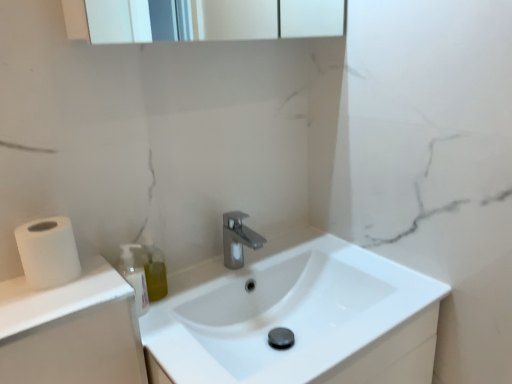
Describe the element at coordinates (296, 319) in the screenshot. I see `white glossy sink at center` at that location.

Where is `translucent plastic soap dispenser at left`? The width and height of the screenshot is (512, 384). translucent plastic soap dispenser at left is located at coordinates (134, 276).

Describe the element at coordinates (134, 276) in the screenshot. I see `translucent plastic soap dispenser at left` at that location.

Locate an element on the screen. The width and height of the screenshot is (512, 384). white matte toilet paper at left is located at coordinates (48, 252).

In the scene shown: Is translucent plastic soap dispenser at left further to the viewer compared to white glossy sink at center?

Yes, translucent plastic soap dispenser at left is further from the camera.

This screenshot has width=512, height=384. I want to click on sink located on the right of translucent plastic soap dispenser at left, so click(x=296, y=319).

Is translucent plastic soap dispenser at left aimed at white glossy sink at center?

No, translucent plastic soap dispenser at left is not facing towards white glossy sink at center.

Is translucent plastic soap dispenser at left at the back of satin nickel faucet at center?

satin nickel faucet at center is not turned away from translucent plastic soap dispenser at left.

Is satin nickel faucet at center to the right of translucent plastic soap dispenser at left from the viewer's perspective?

Correct, you'll find satin nickel faucet at center to the right of translucent plastic soap dispenser at left.

Which object is further away from the camera taking this photo, satin nickel faucet at center or translucent plastic soap dispenser at left?

satin nickel faucet at center is more distant.

Is white glossy sink at center positioned far away from satin nickel faucet at center?

white glossy sink at center is near satin nickel faucet at center, not far away.

Looking at this image, which of these two, white glossy sink at center or satin nickel faucet at center, is wider?

white glossy sink at center.

Is white glossy sink at center bigger than satin nickel faucet at center?

Yes, white glossy sink at center is bigger than satin nickel faucet at center.

Is point (395, 381) positioned after point (255, 233)?

No, (395, 381) is closer to viewer.

In the image, is translucent plastic soap dispenser at left on the left side or the right side of satin nickel faucet at center?

translucent plastic soap dispenser at left is to the left of satin nickel faucet at center.

Is the position of translucent plastic soap dispenser at left less distant than that of satin nickel faucet at center?

That is True.

Do you think translucent plastic soap dispenser at left is within satin nickel faucet at center, or outside of it?

translucent plastic soap dispenser at left lies outside satin nickel faucet at center.

Is translucent plastic soap dispenser at left far from satin nickel faucet at center?

No, translucent plastic soap dispenser at left is in close proximity to satin nickel faucet at center.

Considering the relative sizes of satin nickel faucet at center and white glossy sink at center in the image provided, is satin nickel faucet at center shorter than white glossy sink at center?

Correct, satin nickel faucet at center is not as tall as white glossy sink at center.

Does satin nickel faucet at center come behind white glossy sink at center?

Yes, it is behind white glossy sink at center.

Which is correct: satin nickel faucet at center is inside white glossy sink at center, or outside of it?

satin nickel faucet at center exists outside the volume of white glossy sink at center.

Would you consider satin nickel faucet at center to be distant from white glossy sink at center?

No, satin nickel faucet at center is in close proximity to white glossy sink at center.

Between point (34, 287) and point (139, 295), which one is positioned behind?

The point (139, 295) is behind.

Is white matte toilet paper at left facing away from translucent plastic soap dispenser at left?

No, translucent plastic soap dispenser at left is not at the back of white matte toilet paper at left.

Between white matte toilet paper at left and translucent plastic soap dispenser at left, which one has smaller size?

With smaller size is translucent plastic soap dispenser at left.

Does white matte toilet paper at left have a greater height compared to translucent plastic soap dispenser at left?

No, white matte toilet paper at left is not taller than translucent plastic soap dispenser at left.

Can you confirm if white glossy sink at center is taller than translucent plastic soap dispenser at left?

Correct, white glossy sink at center is much taller as translucent plastic soap dispenser at left.

Would you consider white glossy sink at center to be distant from translucent plastic soap dispenser at left?

No.

Based on the photo, how different are the orientations of white glossy sink at center and translucent plastic soap dispenser at left in degrees?

The angle between the facing direction of white glossy sink at center and the facing direction of translucent plastic soap dispenser at left is 0.902 degrees.

From a real-world perspective, between white glossy sink at center and translucent plastic soap dispenser at left, who is vertically lower?

white glossy sink at center is physically lower.

At what (x,y) coordinates should I click in order to perform the action: click on bottle that appears on the left of white glossy sink at center. Please return your answer as a coordinate pair (x, y). Looking at the image, I should click on (134, 276).

Locate an element on the screen. Image resolution: width=512 pixels, height=384 pixels. tap that is above the translucent plastic soap dispenser at left (from the image's perspective) is located at coordinates (238, 239).

Looking at the image, which one is located further to white glossy sink at center, white matte toilet paper at left or satin nickel faucet at center?

The object further to white glossy sink at center is white matte toilet paper at left.

When comparing their distances from satin nickel faucet at center, does translucent plastic soap dispenser at left or white glossy sink at center seem further?

Among the two, translucent plastic soap dispenser at left is located further to satin nickel faucet at center.

Which object lies further to the anchor point white glossy sink at center, satin nickel faucet at center or white matte toilet paper at left?

white matte toilet paper at left.

Consider the image. Based on their spatial positions, is white matte toilet paper at left or translucent plastic soap dispenser at left further from white glossy sink at center?

white matte toilet paper at left.

Considering their positions, is white matte toilet paper at left positioned closer to translucent plastic soap dispenser at left than satin nickel faucet at center?

white matte toilet paper at left is positioned closer to the anchor translucent plastic soap dispenser at left.

When comparing their distances from white matte toilet paper at left, does white glossy sink at center or satin nickel faucet at center seem closer?

satin nickel faucet at center is positioned closer to the anchor white matte toilet paper at left.

Estimate the real-world distances between objects in this image. Which object is closer to white matte toilet paper at left, white glossy sink at center or translucent plastic soap dispenser at left?

translucent plastic soap dispenser at left lies closer to white matte toilet paper at left than the other object.

From the image, which object appears to be farther from translucent plastic soap dispenser at left, white glossy sink at center or satin nickel faucet at center?

white glossy sink at center lies further to translucent plastic soap dispenser at left than the other object.

Identify the location of bottle located between white matte toilet paper at left and white glossy sink at center in the left-right direction. pos(134,276).

At what (x,y) coordinates should I click in order to perform the action: click on bottle situated between white matte toilet paper at left and satin nickel faucet at center from left to right. Please return your answer as a coordinate pair (x, y). The width and height of the screenshot is (512, 384). Looking at the image, I should click on (134, 276).

You are a GUI agent. You are given a task and a screenshot of the screen. Output one action in this format:
    pyautogui.click(x=<x>, y=<y>)
    Task: Click on the tap situated between translucent plastic soap dispenser at left and white glossy sink at center from left to right
    
    Given the screenshot: What is the action you would take?
    pyautogui.click(x=238, y=239)

Image resolution: width=512 pixels, height=384 pixels. Identify the location of tap located between white matte toilet paper at left and white glossy sink at center in the left-right direction. (238, 239).